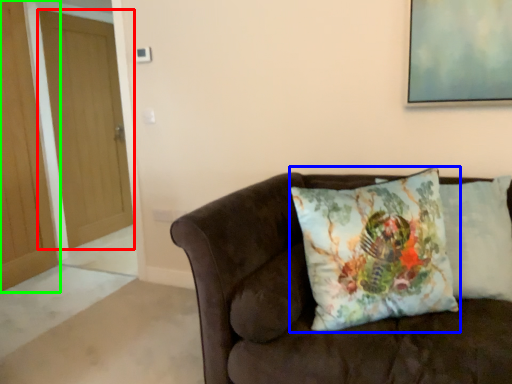
Question: Considering the real-world distances, which object is closest to door (highlighted by a red box)? pillow (highlighted by a blue box) or door (highlighted by a green box).

Choices:
 (A) pillow
 (B) door

Answer: (B)